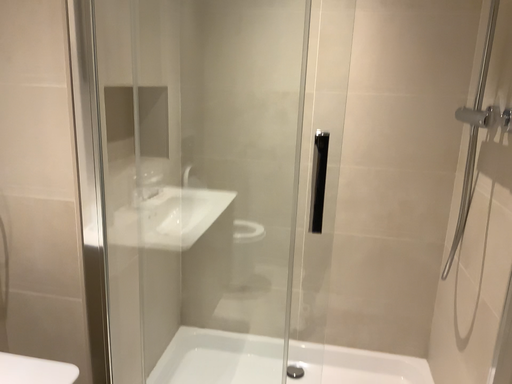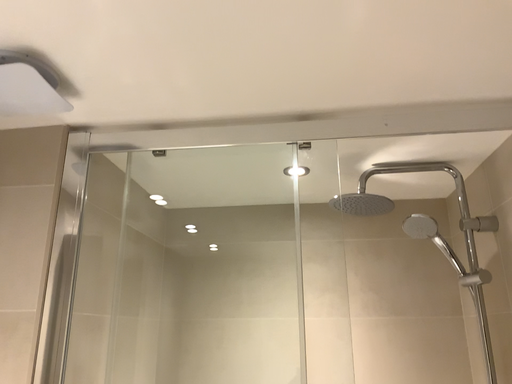
Question: How did the camera likely rotate when shooting the video?

Choices:
 (A) rotated downward
 (B) rotated upward

Answer: (B)